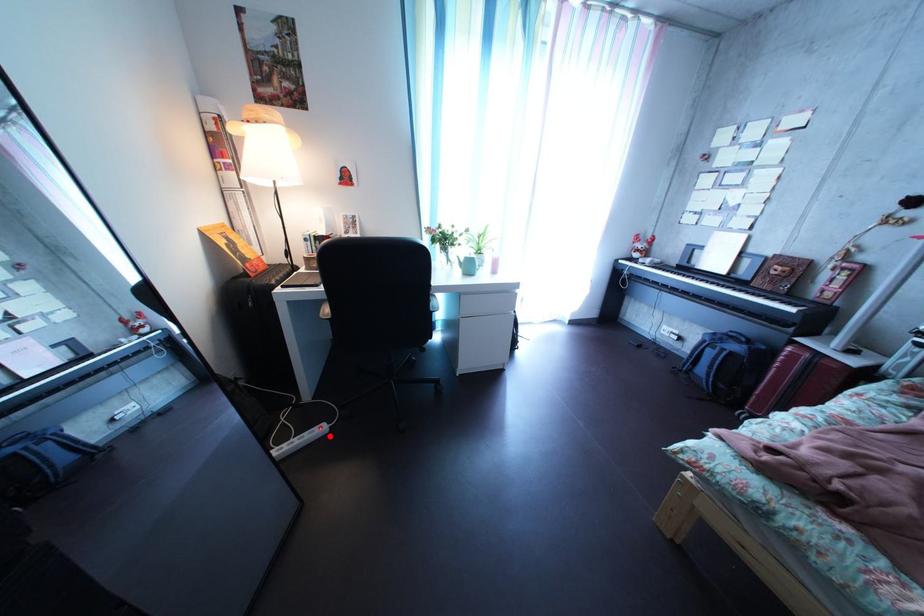
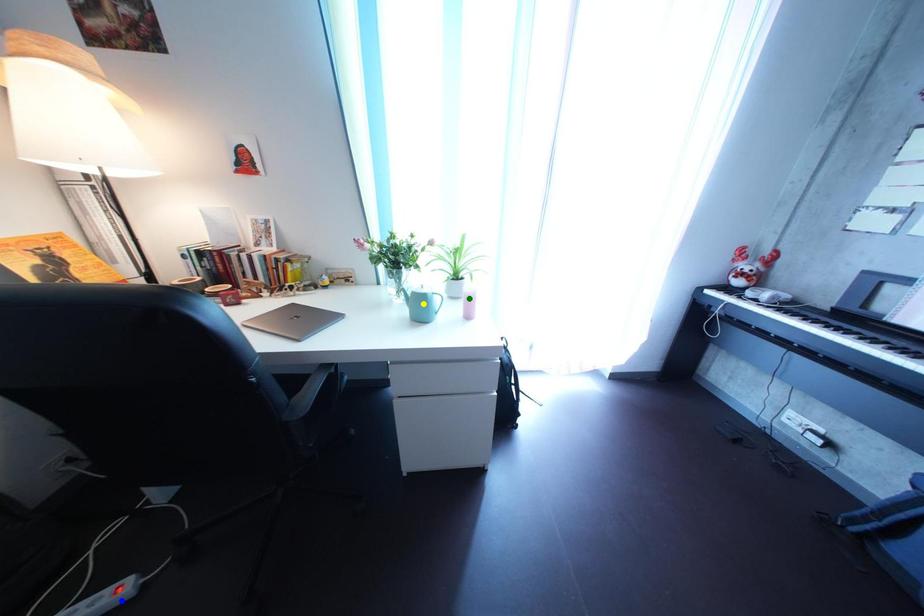
Question: I am providing you with two images of the same scene from different viewpoints. A red point is marked on the first image. You are given multiple points on the second image. In image 2, which mark is for the same physical point as the one in image 1?

Choices:
 (A) green point
 (B) blue point
 (C) yellow point

Answer: (B)